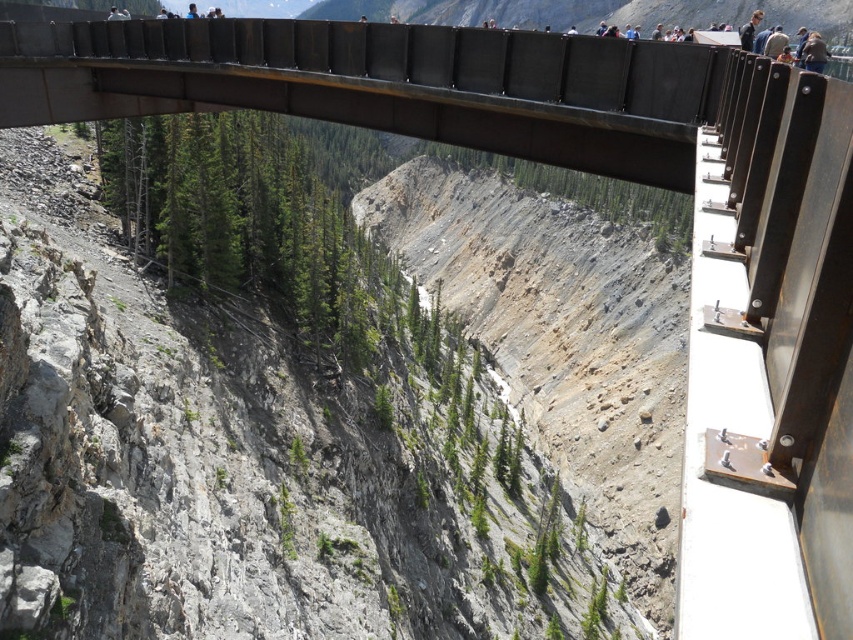
From the picture: You are a hiker who wants to cross the metallic bridge at center while carrying a dark brown leather jacket at upper center. Since the bridge is narrow, will the jacket fit on the bridge without hanging over the edge?

The metallic bridge at center is wider than the dark brown leather jacket at upper center, so the jacket will fit on the bridge without hanging over the edge.

You are standing on the metal bridge in the image. You see a point marked at coordinates [561,340]. What object is located at that point?

The point at coordinates [561,340] indicates a dull gray rock at center.

You are a hiker standing on the metallic bridge at center. You look down and see the dull gray rock at center below you. Can you estimate which object is closer to the ground?

The metallic bridge at center is shorter than the dull gray rock at center, so the metallic bridge at center is closer to the ground than the dull gray rock at center.